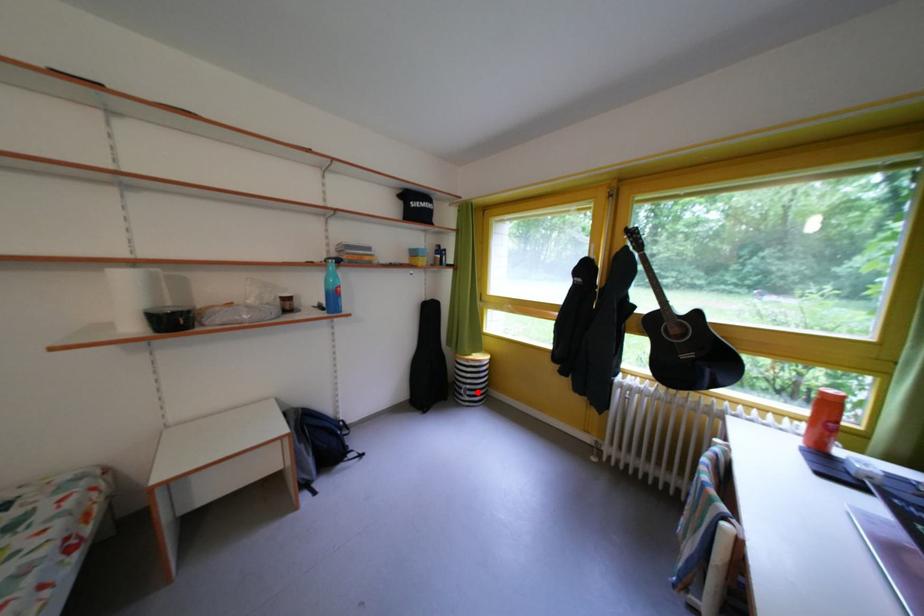
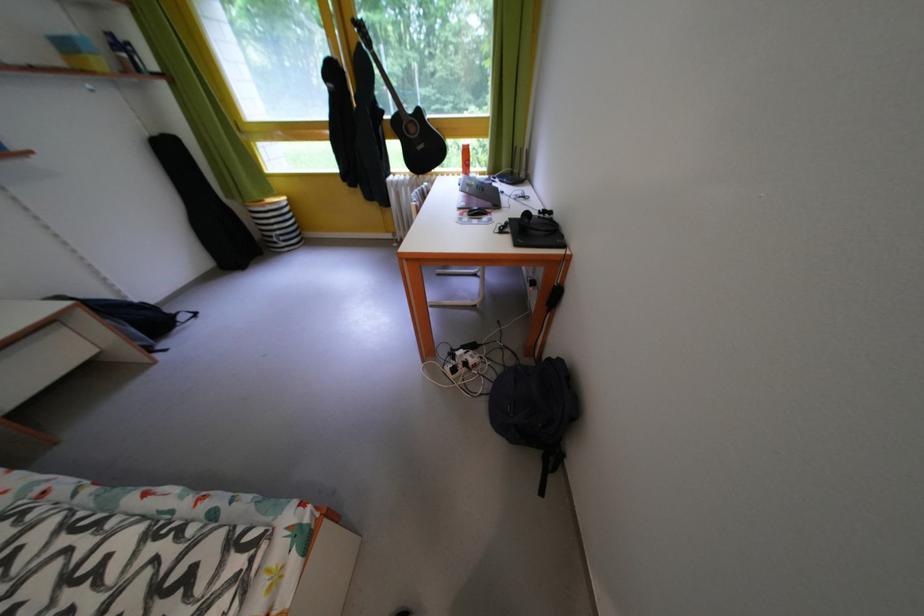
In the second image, find the point that corresponds to the highlighted location in the first image.

(287, 238)